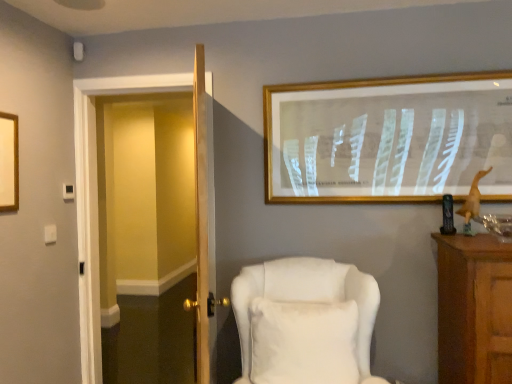
Locate an element on the screen. white fabric chair at center is located at coordinates (305, 322).

This screenshot has height=384, width=512. What do you see at coordinates (303, 342) in the screenshot?
I see `white fluffy pillow at center` at bounding box center [303, 342].

Where is `white fabric chair at center`? white fabric chair at center is located at coordinates (305, 322).

From the image's perspective, is white fabric chair at center on gold-framed artwork at upper center?

No, from the image's perspective, white fabric chair at center is not on top of gold-framed artwork at upper center.

At what (x,y) coordinates should I click in order to perform the action: click on picture frame that is above the white fabric chair at center (from the image's perspective). Please return your answer as a coordinate pair (x, y). Looking at the image, I should click on (388, 138).

Looking at the image, does white fabric chair at center seem bigger or smaller compared to gold-framed artwork at upper center?

Clearly, white fabric chair at center is larger in size than gold-framed artwork at upper center.

Considering the sizes of objects white fabric chair at center and gold-framed artwork at upper center in the image provided, who is thinner, white fabric chair at center or gold-framed artwork at upper center?

gold-framed artwork at upper center.

From a real-world perspective, is white fabric chair at center positioned above or below transparent glass door at left?

white fabric chair at center is situated lower than transparent glass door at left in the real world.

Is white fabric chair at center next to transparent glass door at left and touching it?

No.

Is white fabric chair at center facing away from transparent glass door at left?

white fabric chair at center does not have its back to transparent glass door at left.

Can we say white fabric chair at center lies outside transparent glass door at left?

Yes, white fabric chair at center is outside of transparent glass door at left.

In the scene shown: Can you confirm if white fluffy pillow at center is taller than gold-framed artwork at upper center?

In fact, white fluffy pillow at center may be shorter than gold-framed artwork at upper center.

Which of these two, white fluffy pillow at center or gold-framed artwork at upper center, is thinner?

gold-framed artwork at upper center is thinner.

Is white fluffy pillow at center far from gold-framed artwork at upper center?

white fluffy pillow at center is near gold-framed artwork at upper center, not far away.

Is white fluffy pillow at center to the left or to the right of gold-framed artwork at upper center in the image?

In the image, white fluffy pillow at center appears on the left side of gold-framed artwork at upper center.

Which of these two, transparent glass door at left or gold-framed artwork at upper center, is thinner?

Thinner between the two is gold-framed artwork at upper center.

Is transparent glass door at left shorter than gold-framed artwork at upper center?

No.

Is transparent glass door at left completely or partially outside of gold-framed artwork at upper center?

transparent glass door at left lies outside gold-framed artwork at upper center's area.

Between point (92, 273) and point (280, 153), which one is positioned behind?

The point (92, 273) is farther from the camera.

How different are the orientations of gold-framed artwork at upper center and white fluffy pillow at center in degrees?

11.4 degrees separate the facing orientations of gold-framed artwork at upper center and white fluffy pillow at center.

Consider the image. Is gold-framed artwork at upper center looking in the opposite direction of white fluffy pillow at center?

gold-framed artwork at upper center does not have its back to white fluffy pillow at center.

From a real-world perspective, which is physically above, gold-framed artwork at upper center or white fluffy pillow at center?

In real-world perspective, gold-framed artwork at upper center is above.

Does gold-framed artwork at upper center have a greater height compared to white fluffy pillow at center?

Yes, gold-framed artwork at upper center is taller than white fluffy pillow at center.

Is transparent glass door at left turned away from white fluffy pillow at center?

No, transparent glass door at left is not facing away from white fluffy pillow at center.

Between transparent glass door at left and white fluffy pillow at center, which one appears on the right side from the viewer's perspective?

white fluffy pillow at center.

How different are the orientations of transparent glass door at left and white fluffy pillow at center in degrees?

The angle between the facing direction of transparent glass door at left and the facing direction of white fluffy pillow at center is 11.4 degrees.

Does transparent glass door at left touch white fluffy pillow at center?

transparent glass door at left and white fluffy pillow at center are clearly separated.

Identify the location of picture frame behind the white fabric chair at center. The height and width of the screenshot is (384, 512). (388, 138).

Is gold-framed artwork at upper center far away from white fabric chair at center?

No, gold-framed artwork at upper center is not far away from white fabric chair at center.

Is gold-framed artwork at upper center further to camera compared to white fabric chair at center?

Yes, it is.

From a real-world perspective, between gold-framed artwork at upper center and white fabric chair at center, who is vertically higher?

gold-framed artwork at upper center is physically above.

Find the location of a particular element. picture frame above the white fabric chair at center (from the image's perspective) is located at coordinates (388, 138).

The height and width of the screenshot is (384, 512). I want to click on chair that appears below the transparent glass door at left (from a real-world perspective), so click(305, 322).

Which object lies further to the anchor point gold-framed artwork at upper center, transparent glass door at left or white fabric chair at center?

Based on the image, transparent glass door at left appears to be further to gold-framed artwork at upper center.

Considering their positions, is transparent glass door at left positioned further to white fabric chair at center than white fluffy pillow at center?

The object further to white fabric chair at center is transparent glass door at left.

Which object lies further to the anchor point transparent glass door at left, white fluffy pillow at center or gold-framed artwork at upper center?

white fluffy pillow at center.

Which object lies nearer to the anchor point white fluffy pillow at center, gold-framed artwork at upper center or transparent glass door at left?

gold-framed artwork at upper center.

Based on their spatial positions, is gold-framed artwork at upper center or white fabric chair at center further from transparent glass door at left?

Based on the image, white fabric chair at center appears to be further to transparent glass door at left.

Based on their spatial positions, is white fluffy pillow at center or gold-framed artwork at upper center closer to white fabric chair at center?

Among the two, white fluffy pillow at center is located nearer to white fabric chair at center.

When comparing their distances from gold-framed artwork at upper center, does white fluffy pillow at center or transparent glass door at left seem closer?

The object closer to gold-framed artwork at upper center is white fluffy pillow at center.

Estimate the real-world distances between objects in this image. Which object is closer to white fluffy pillow at center, transparent glass door at left or white fabric chair at center?

white fabric chair at center is closer to white fluffy pillow at center.

This screenshot has height=384, width=512. Identify the location of chair located between transparent glass door at left and gold-framed artwork at upper center in the left-right direction. (305, 322).

Find the location of a particular element. Image resolution: width=512 pixels, height=384 pixels. pillow between white fabric chair at center and transparent glass door at left from front to back is located at coordinates (303, 342).

Identify the location of pillow between gold-framed artwork at upper center and white fabric chair at center in the vertical direction. The width and height of the screenshot is (512, 384). (303, 342).

Where is `pillow between transparent glass door at left and gold-framed artwork at upper center in the horizontal direction`? Image resolution: width=512 pixels, height=384 pixels. pillow between transparent glass door at left and gold-framed artwork at upper center in the horizontal direction is located at coordinates (303, 342).